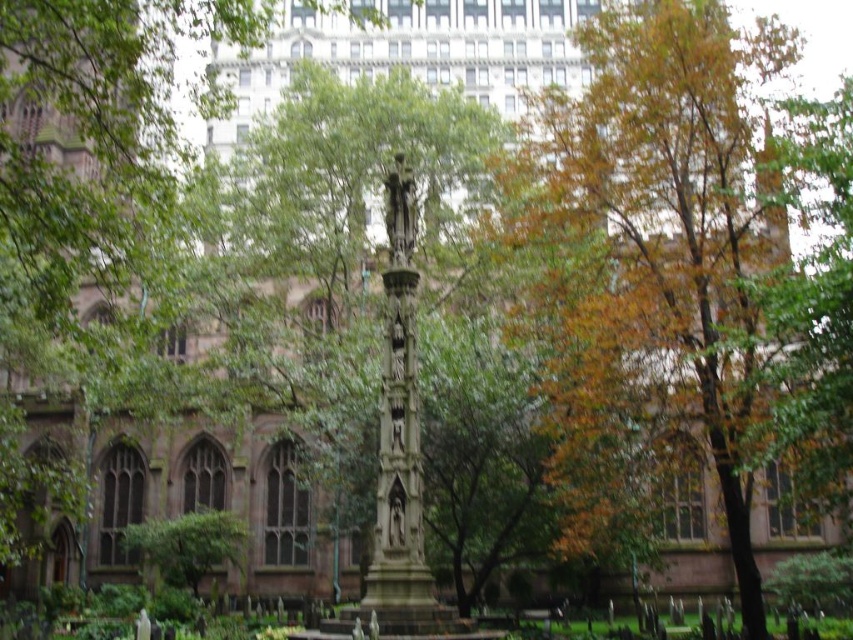
Can you confirm if autumn leaves at center is positioned to the right of green leafy tree at lower left?

Yes, autumn leaves at center is to the right of green leafy tree at lower left.

Is autumn leaves at center shorter than green leafy tree at lower left?

In fact, autumn leaves at center may be taller than green leafy tree at lower left.

I want to click on autumn leaves at center, so click(x=683, y=272).